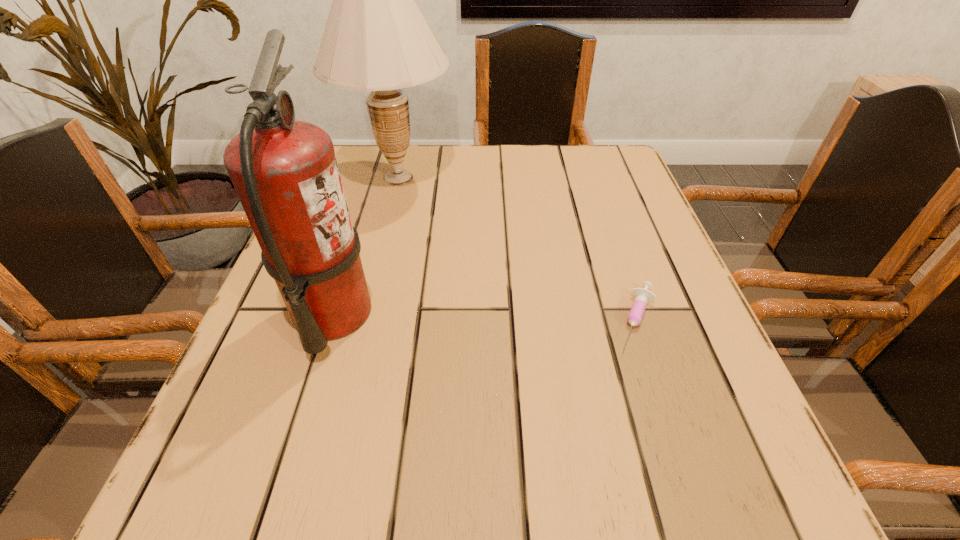
Image resolution: width=960 pixels, height=540 pixels. Identify the location of free area in between the lampshade and the fire extinguisher. (366, 246).

Locate an element on the screen. empty location between the syringe and the fire extinguisher is located at coordinates (484, 317).

I want to click on vacant area that lies between the rightmost object and the lampshade, so click(x=517, y=248).

The width and height of the screenshot is (960, 540). Identify the location of vacant area that lies between the farthest object and the fire extinguisher. (366, 246).

Identify the location of free point between the lampshade and the syringe. This screenshot has width=960, height=540. (517, 248).

Where is `free space that is in between the farthest object and the fire extinguisher`? Image resolution: width=960 pixels, height=540 pixels. free space that is in between the farthest object and the fire extinguisher is located at coordinates (366, 246).

Find the location of a particular element. empty space between the lampshade and the rightmost object is located at coordinates (517, 248).

I want to click on vacant area between the syringe and the fire extinguisher, so click(x=484, y=317).

At what (x,y) coordinates should I click in order to perform the action: click on vacant space that is in between the fire extinguisher and the farthest object. Please return your answer as a coordinate pair (x, y). Image resolution: width=960 pixels, height=540 pixels. Looking at the image, I should click on (366, 246).

Identify the location of free point between the fire extinguisher and the syringe. This screenshot has width=960, height=540. (484, 317).